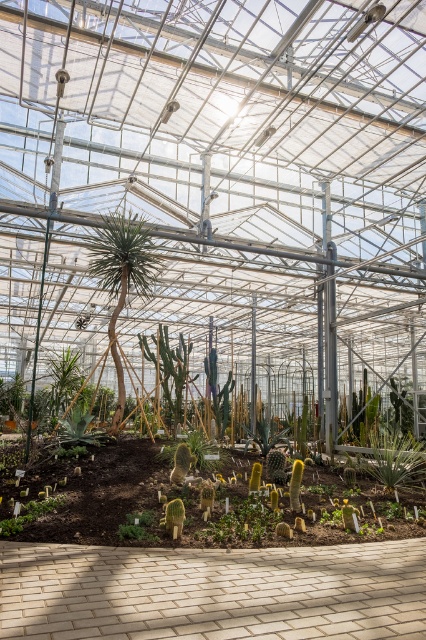
Looking at this image, who is higher up, green leafy plant at center or green matte cactus at lower left?

green matte cactus at lower left

Which of these two, green leafy plant at center or green matte cactus at lower left, stands shorter?

green matte cactus at lower left

Who is more forward, [397,483] or [20,524]?

Positioned in front is point [20,524].

I want to click on green leafy plant at center, so 396,461.